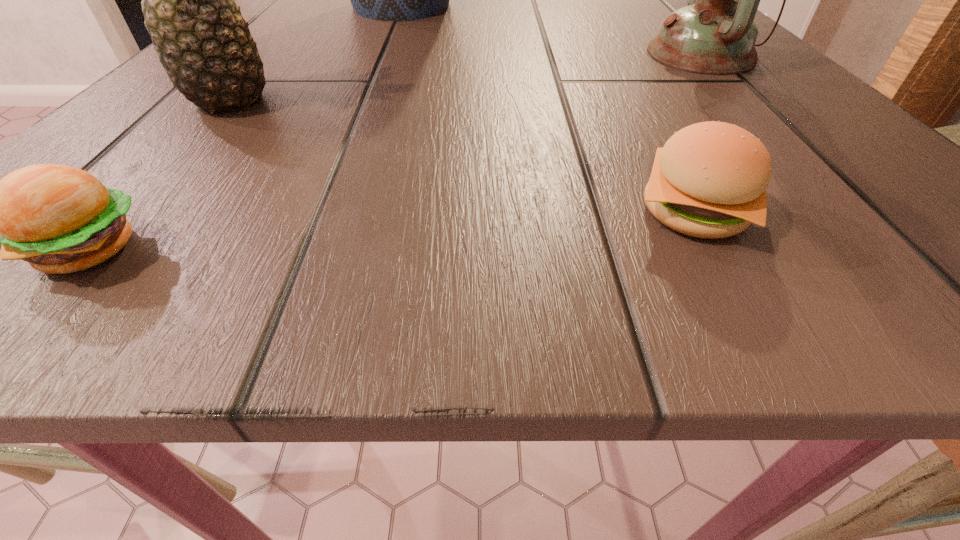
At what (x,y) coordinates should I click in order to perform the action: click on hamburger that is at the right edge. Please return your answer as a coordinate pair (x, y). Looking at the image, I should click on (709, 180).

This screenshot has width=960, height=540. Find the location of `object situated at the near right corner`. object situated at the near right corner is located at coordinates (709, 180).

In the image, there is a desktop. Where is `free space at the far edge`? The image size is (960, 540). free space at the far edge is located at coordinates (503, 31).

Locate an element on the screen. The width and height of the screenshot is (960, 540). blank space at the near edge of the desktop is located at coordinates (600, 243).

Locate an element on the screen. This screenshot has width=960, height=540. vacant space at the far left corner of the desktop is located at coordinates (347, 3).

In the image, there is a desktop. Identify the location of vacant area at the far right corner. (606, 1).

In the image, there is a desktop. Identify the location of vacant space at the near right corner. (835, 298).

Where is `vacant region between the third farthest object and the right hamburger`? Image resolution: width=960 pixels, height=540 pixels. vacant region between the third farthest object and the right hamburger is located at coordinates (463, 157).

At what (x,y) coordinates should I click in order to perform the action: click on free space between the third nearest object and the right hamburger. Please return your answer as a coordinate pair (x, y). Looking at the image, I should click on (463, 157).

Where is `blank region between the fourth nearest object and the third farthest object`? The height and width of the screenshot is (540, 960). blank region between the fourth nearest object and the third farthest object is located at coordinates (467, 79).